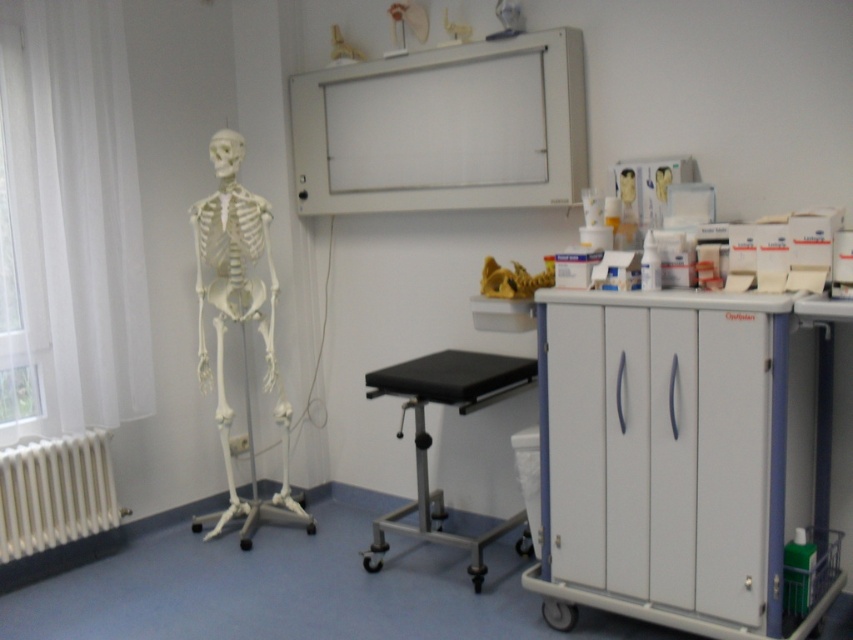
Question: Can you confirm if white plastic skeleton at left is positioned above black rubber stool at center?

Choices:
 (A) yes
 (B) no

Answer: (A)

Question: Which point is closer to the camera taking this photo?

Choices:
 (A) (28, 445)
 (B) (422, 394)
 (C) (238, 289)

Answer: (B)

Question: Is white plastic skeleton at left wider than black rubber stool at center?

Choices:
 (A) yes
 (B) no

Answer: (B)

Question: Which of the following is the farthest from the observer?

Choices:
 (A) (250, 456)
 (B) (381, 387)

Answer: (A)

Question: Which object appears farthest from the camera in this image?

Choices:
 (A) white plastic skeleton at left
 (B) white matte radiator at lower left
 (C) black rubber stool at center

Answer: (A)

Question: Where is white plastic skeleton at left located in relation to black rubber stool at center in the image?

Choices:
 (A) below
 (B) above

Answer: (B)